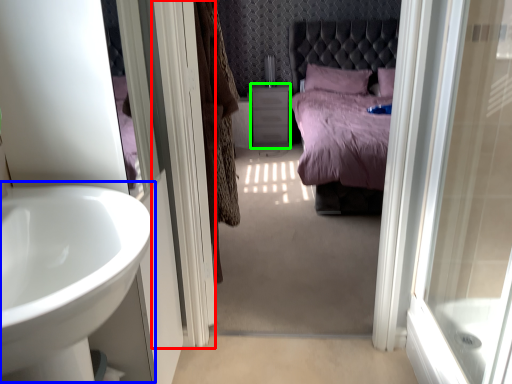
Question: Which object is the closest to the screen door (highlighted by a red box)? Choose among these: sink (highlighted by a blue box) or vanity (highlighted by a green box).

Choices:
 (A) sink
 (B) vanity

Answer: (A)